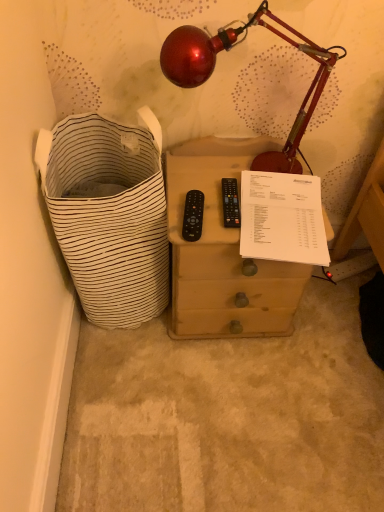
At what (x,y) coordinates should I click in order to perform the action: click on free space above wooden nightstand at center (from a real-world perspective). Please return your answer as a coordinate pair (x, y). This screenshot has height=512, width=384. Looking at the image, I should click on (242, 199).